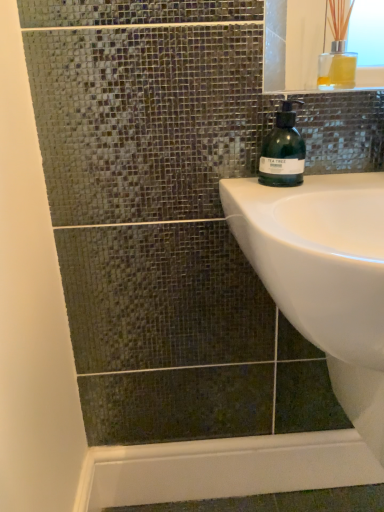
In order to face white glossy sink at right, should I rotate leftwards or rightwards?

A 20.571 degree turn to the right will do.

Where is `white glossy sink at right`? The image size is (384, 512). white glossy sink at right is located at coordinates (324, 276).

Describe the element at coordinates (324, 276) in the screenshot. The image size is (384, 512). I see `white glossy sink at right` at that location.

Identify the location of white glossy sink at right. This screenshot has height=512, width=384. (324, 276).